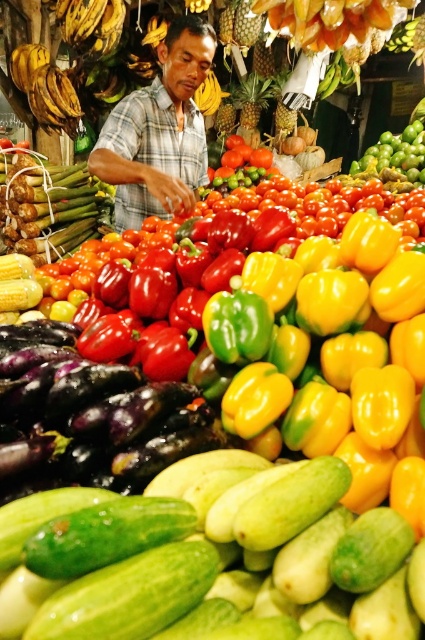
Question: In this image, where is green smooth cucumber at center located relative to plaid fabric vendor at center?

Choices:
 (A) below
 (B) above

Answer: (A)

Question: Among these objects, which one is farthest from the camera?

Choices:
 (A) green smooth cucumber at center
 (B) plaid fabric vendor at center

Answer: (B)

Question: From the image, what is the correct spatial relationship of green smooth cucumber at center in relation to plaid fabric vendor at center?

Choices:
 (A) above
 (B) below

Answer: (B)

Question: Is green smooth cucumber at center smaller than plaid fabric vendor at center?

Choices:
 (A) yes
 (B) no

Answer: (A)